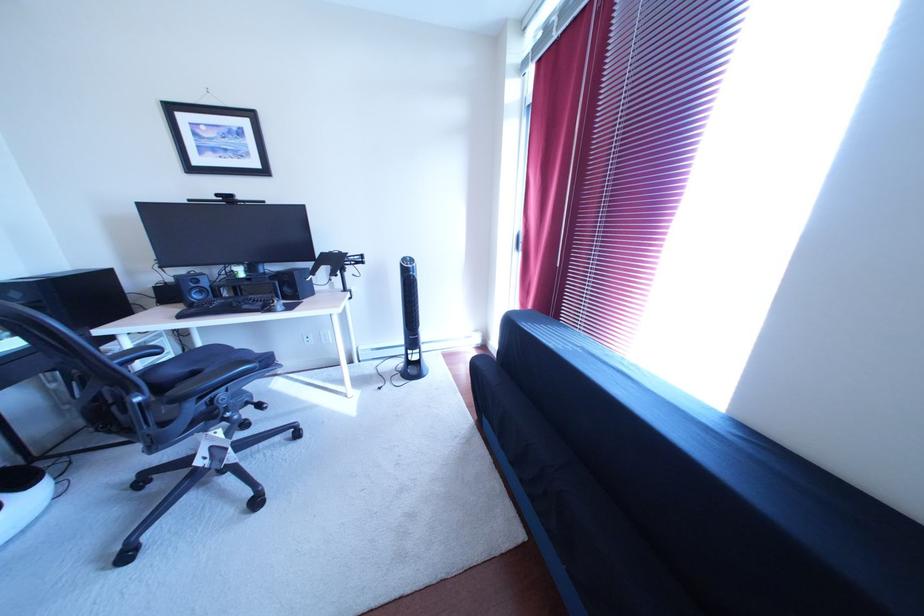
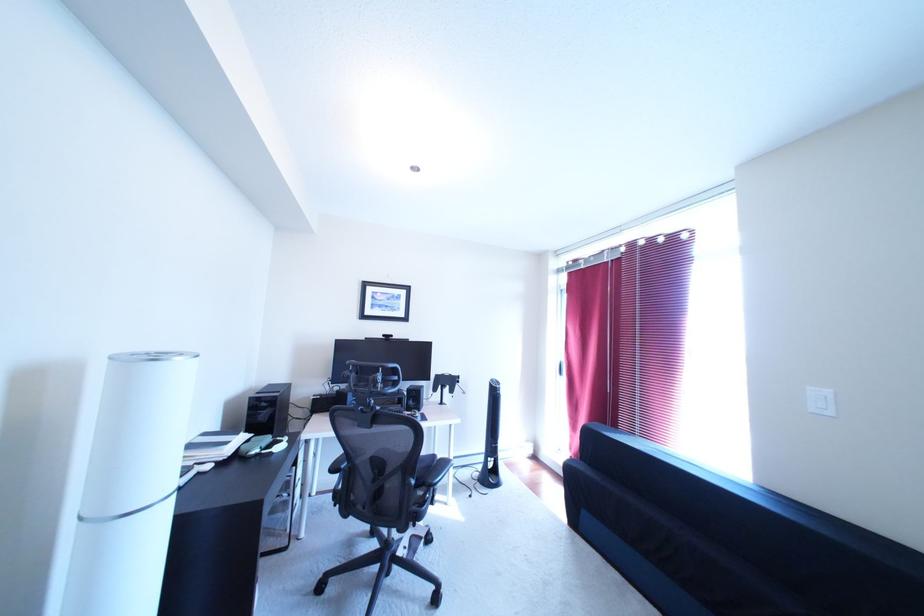
In a continuous first-person perspective shot, in which direction is the camera moving?

The cameraman moved toward left, backward.